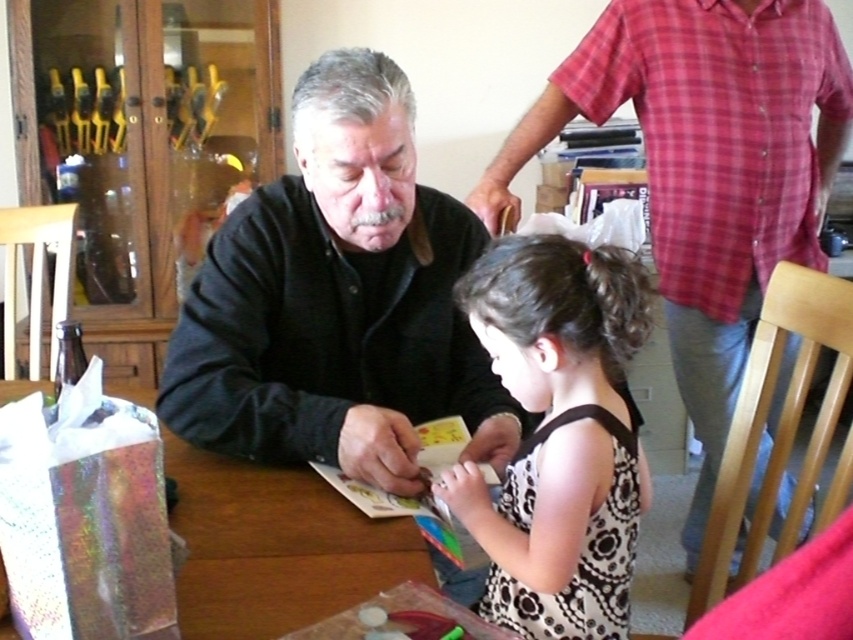
Question: Which point is closer to the camera?

Choices:
 (A) black floral dress at center
 (B) wooden table at center
 (C) black matte shirt at center
 (D) matte black sweater at left

Answer: (B)

Question: In this image, where is black matte shirt at center located relative to black floral dress at center?

Choices:
 (A) left
 (B) right

Answer: (A)

Question: Is black matte shirt at center above black floral dress at center?

Choices:
 (A) no
 (B) yes

Answer: (B)

Question: Among these objects, which one is farthest from the camera?

Choices:
 (A) black matte shirt at center
 (B) matte black sweater at left
 (C) wooden table at center
 (D) black floral dress at center

Answer: (B)

Question: Which point is farther from the camera taking this photo?

Choices:
 (A) (286, 548)
 (B) (712, 193)

Answer: (B)

Question: Is black matte shirt at center wider than black floral dress at center?

Choices:
 (A) no
 (B) yes

Answer: (B)